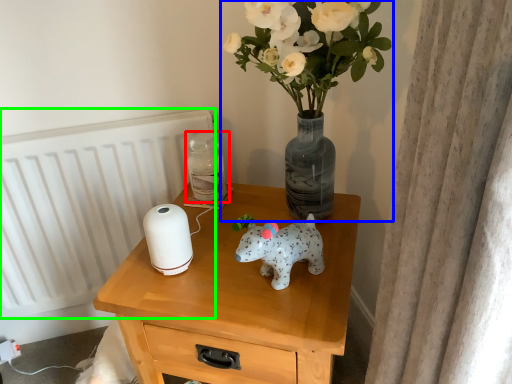
Question: Based on their relative distances, which object is farther from bottle (highlighted by a red box)? Choose from houseplant (highlighted by a blue box) and radiator (highlighted by a green box).

Choices:
 (A) houseplant
 (B) radiator

Answer: (B)